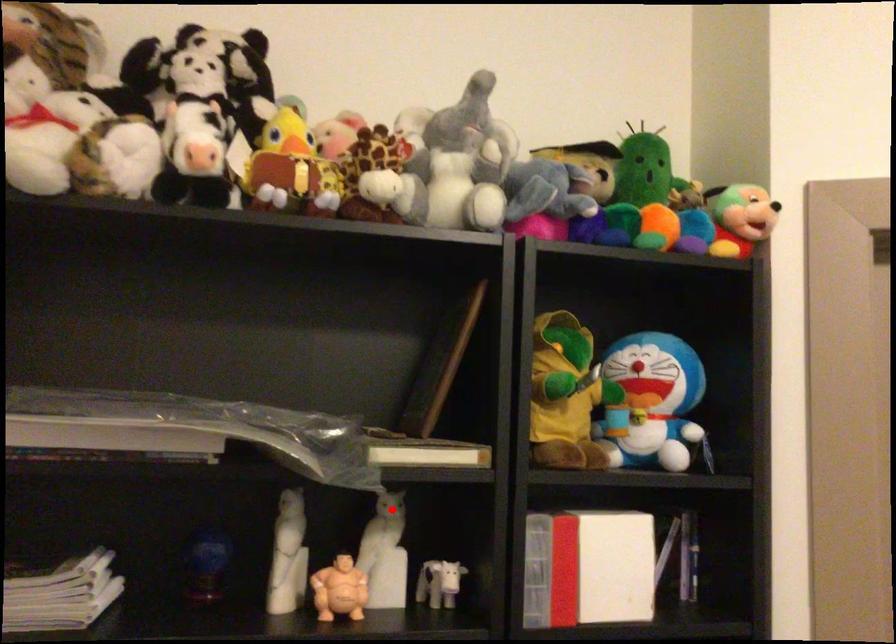
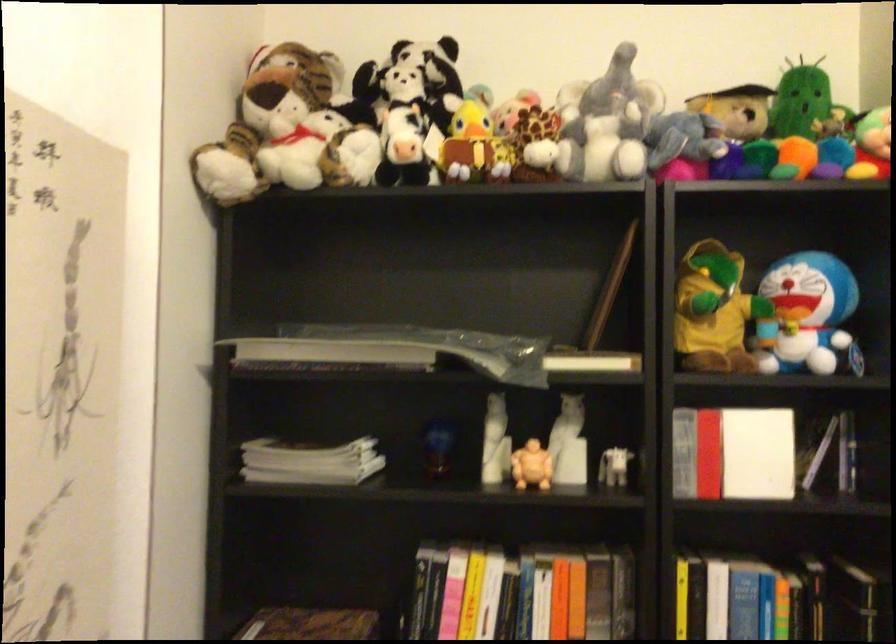
Question: A red point is marked in image1. In image2, is the corresponding 3D point closer to the camera or farther? Reply with the corresponding letter.

Choices:
 (A) The corresponding 3D point is closer.
 (B) The corresponding 3D point is farther.

Answer: (B)